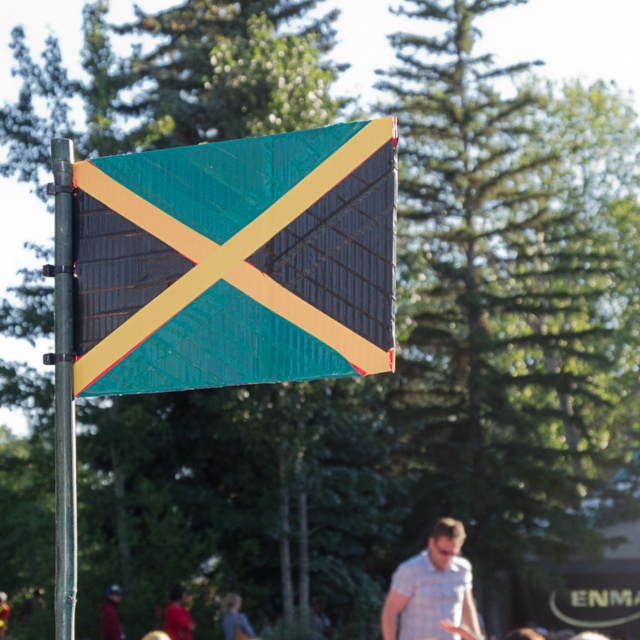
Between textured fabric flag at center and metallic pole at left, which one has less height?

With less height is textured fabric flag at center.

Does textured fabric flag at center appear on the right side of metallic pole at left?

Indeed, textured fabric flag at center is positioned on the right side of metallic pole at left.

Is point (269, 378) less distant than point (67, 365)?

Yes.

You are a GUI agent. You are given a task and a screenshot of the screen. Output one action in this format:
    pyautogui.click(x=<x>, y=<y>)
    Task: Click on the textured fabric flag at center
    This screenshot has height=640, width=640.
    Given the screenshot: What is the action you would take?
    pyautogui.click(x=236, y=260)

Can you confirm if textured fabric flag at center is positioned to the right of dark red fabric at lower left?

Yes, textured fabric flag at center is to the right of dark red fabric at lower left.

Which is in front, point (336, 305) or point (113, 614)?

Point (336, 305) is more forward.

You are a GUI agent. You are given a task and a screenshot of the screen. Output one action in this format:
    pyautogui.click(x=<x>, y=<y>)
    Task: Click on the textured fabric flag at center
    The width and height of the screenshot is (640, 640).
    Given the screenshot: What is the action you would take?
    pyautogui.click(x=236, y=260)

The height and width of the screenshot is (640, 640). I want to click on textured fabric flag at center, so click(x=236, y=260).

From the picture: Who is positioned more to the left, light blue plaid shirt at center or blue denim shirt at lower center?

From the viewer's perspective, blue denim shirt at lower center appears more on the left side.

Identify the location of light blue plaid shirt at center. (432, 588).

Does point (464, 588) come farther from viewer compared to point (232, 612)?

No, it is not.

Find the location of a particular element. This screenshot has height=640, width=640. light blue plaid shirt at center is located at coordinates (432, 588).